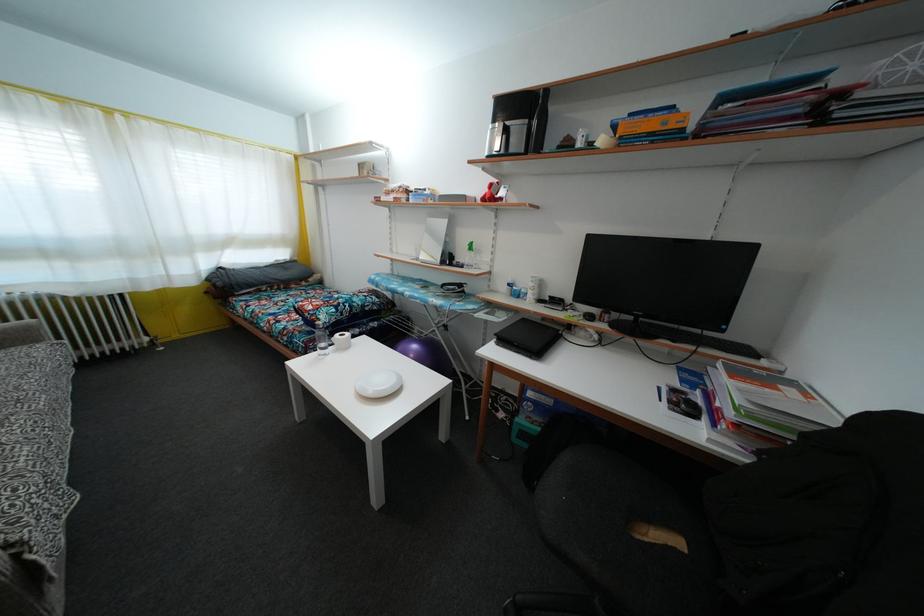
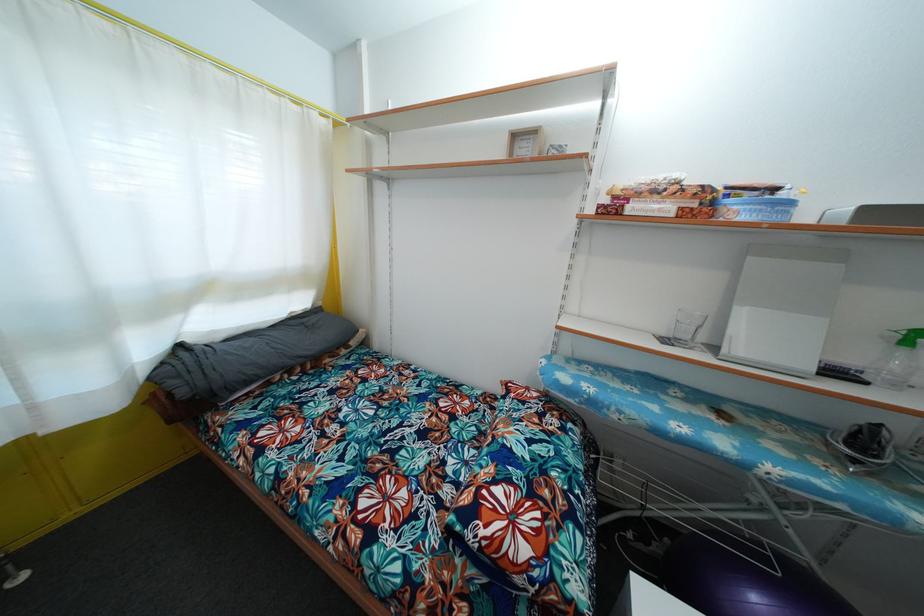
The images are taken continuously from a first-person perspective. In which direction are you moving?

The movement direction of the cameraman is left, forward.